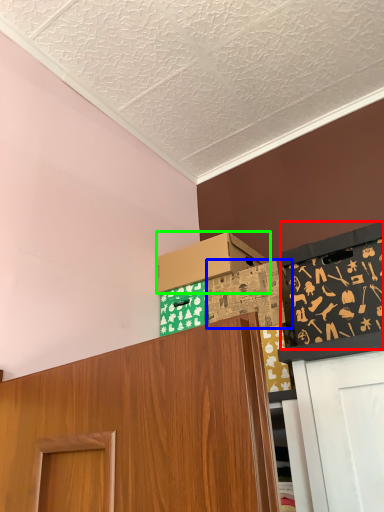
Question: Estimate the real-world distances between objects in this image. Which object is closer to bulletin board (highlighted by a red box), box (highlighted by a blue box) or box (highlighted by a green box)?

Choices:
 (A) box
 (B) box

Answer: (A)